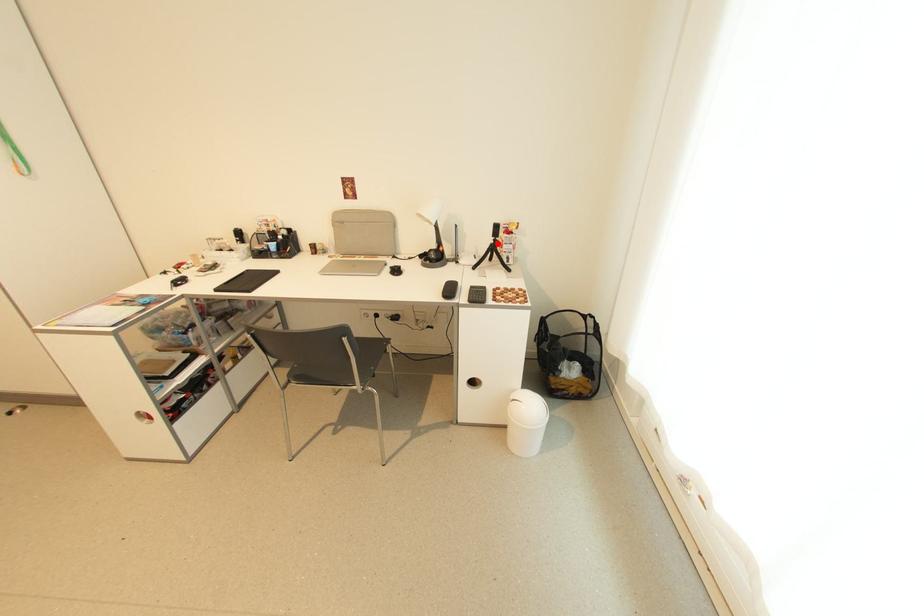
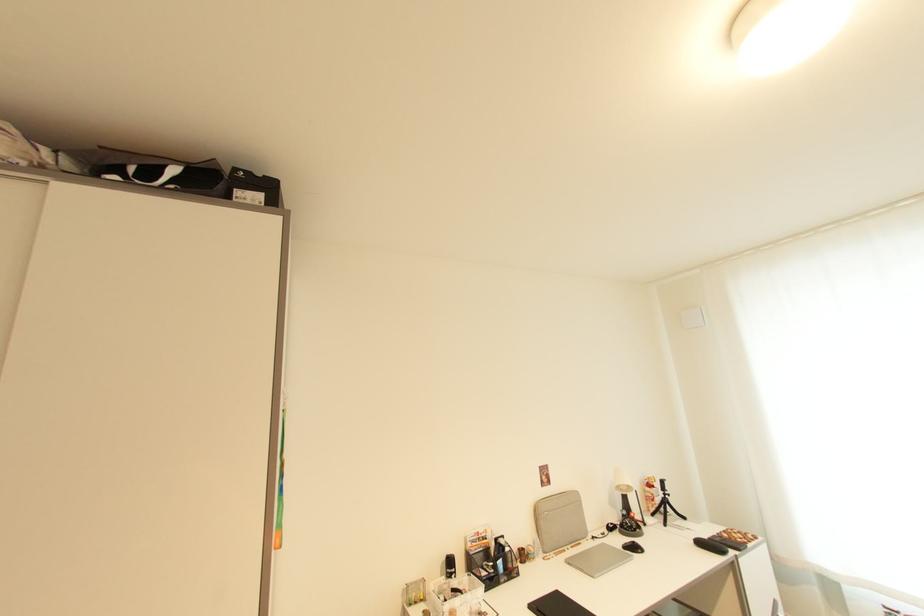
Locate, in the second image, the point that corresponds to the highlighted location in the first image.

(669, 498)